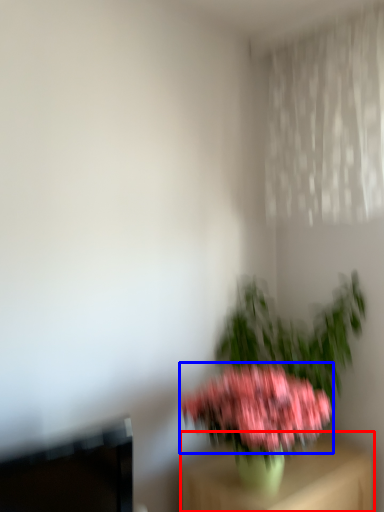
Question: Which of the following is the closest to the observer, furniture (highlighted by a red box) or flower (highlighted by a blue box)?

Choices:
 (A) furniture
 (B) flower

Answer: (B)